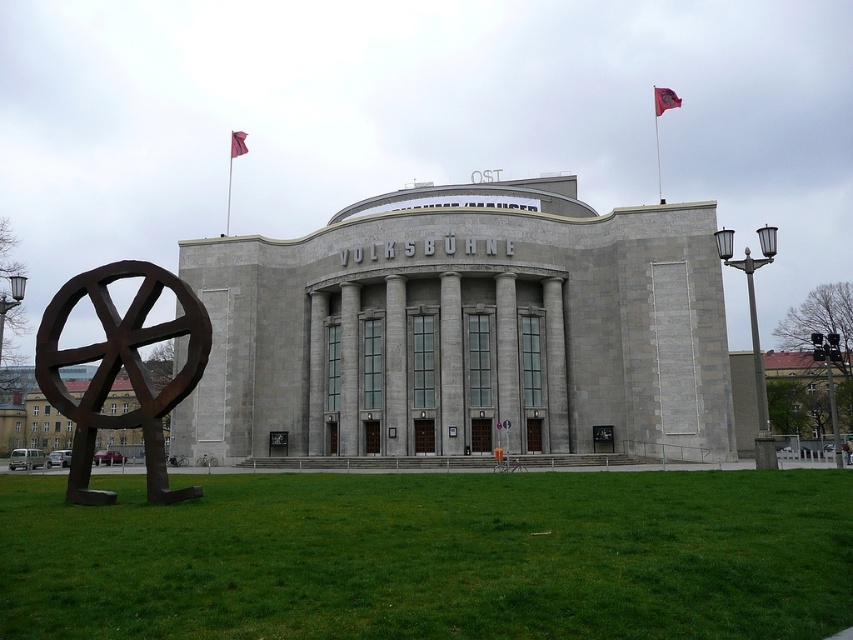
Question: Can you confirm if green grass at lower center is smaller than red fabric flag at upper right?

Choices:
 (A) no
 (B) yes

Answer: (B)

Question: Can you confirm if green grass at lower center is wider than red fabric flag at upper center?

Choices:
 (A) yes
 (B) no

Answer: (A)

Question: Is green grass at lower center above rusty metal sculpture at center?

Choices:
 (A) no
 (B) yes

Answer: (A)

Question: Estimate the real-world distances between objects in this image. Which object is closer to the green grass at lower center?

Choices:
 (A) red fabric flag at upper right
 (B) red fabric flag at upper center

Answer: (B)

Question: Which point appears closest to the camera in this image?

Choices:
 (A) (148, 404)
 (B) (666, 99)
 (C) (230, 156)
 (D) (601, 577)

Answer: (D)

Question: Which of the following is the farthest from the observer?

Choices:
 (A) rusty metal sculpture at center
 (B) green grass at lower center
 (C) red fabric flag at upper right
 (D) red fabric flag at upper center

Answer: (C)